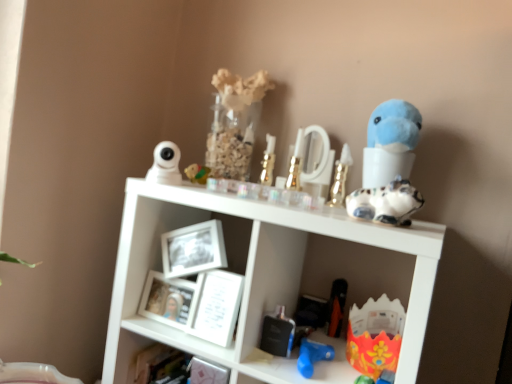
Question: Is white plastic camera at upper left, the 10th toy when ordered from right to left, outside of gold metallic perfume bottle at center, which ranks as the sixth toy in right-to-left order?

Choices:
 (A) no
 (B) yes

Answer: (B)

Question: Is white plastic camera at upper left, which is counted as the 1th toy, starting from the left, wider than gold metallic perfume bottle at center, which appears as the fifth toy when viewed from the left?

Choices:
 (A) no
 (B) yes

Answer: (B)

Question: Can you confirm if white plastic camera at upper left, the 10th toy when ordered from right to left, is bigger than gold metallic perfume bottle at center, which ranks as the sixth toy in right-to-left order?

Choices:
 (A) no
 (B) yes

Answer: (B)

Question: Can you confirm if white plastic camera at upper left, which is counted as the 1th toy, starting from the left, is positioned to the left of gold metallic perfume bottle at center, which appears as the fifth toy when viewed from the left?

Choices:
 (A) no
 (B) yes

Answer: (B)

Question: Does white plastic camera at upper left, the 10th toy when ordered from right to left, have a lesser width compared to gold metallic perfume bottle at center, which appears as the fifth toy when viewed from the left?

Choices:
 (A) no
 (B) yes

Answer: (A)

Question: Is gold metallic perfume bottle at center, which ranks as the sixth toy in right-to-left order, at the back of white plastic camera at upper left, which is counted as the 1th toy, starting from the left?

Choices:
 (A) yes
 (B) no

Answer: (B)

Question: Is white plastic camera at upper left, the 10th toy when ordered from right to left, inside white matte picture frame at center, which is the 2th picture frame from right to left?

Choices:
 (A) no
 (B) yes

Answer: (A)

Question: From the image's perspective, is white matte picture frame at center, which is the 2th picture frame from right to left, above white plastic camera at upper left, which is counted as the 1th toy, starting from the left?

Choices:
 (A) no
 (B) yes

Answer: (A)

Question: Is white matte picture frame at center, arranged as the first picture frame when viewed from the left, smaller than white plastic camera at upper left, which is counted as the 1th toy, starting from the left?

Choices:
 (A) no
 (B) yes

Answer: (A)

Question: Does white matte picture frame at center, arranged as the first picture frame when viewed from the left, have a lesser height compared to white plastic camera at upper left, which is counted as the 1th toy, starting from the left?

Choices:
 (A) yes
 (B) no

Answer: (B)

Question: Is white matte picture frame at center, arranged as the first picture frame when viewed from the left, oriented towards white plastic camera at upper left, the 10th toy when ordered from right to left?

Choices:
 (A) yes
 (B) no

Answer: (B)

Question: Can you confirm if white matte picture frame at center, which is the 2th picture frame from right to left, is positioned to the right of white plastic camera at upper left, the 10th toy when ordered from right to left?

Choices:
 (A) no
 (B) yes

Answer: (B)

Question: Is metallic silver perfume bottle at lower center, which is counted as the 7th toy, starting from the right, taller than speckled ceramic cat at upper right, which appears as the second toy when viewed from the right?

Choices:
 (A) yes
 (B) no

Answer: (B)